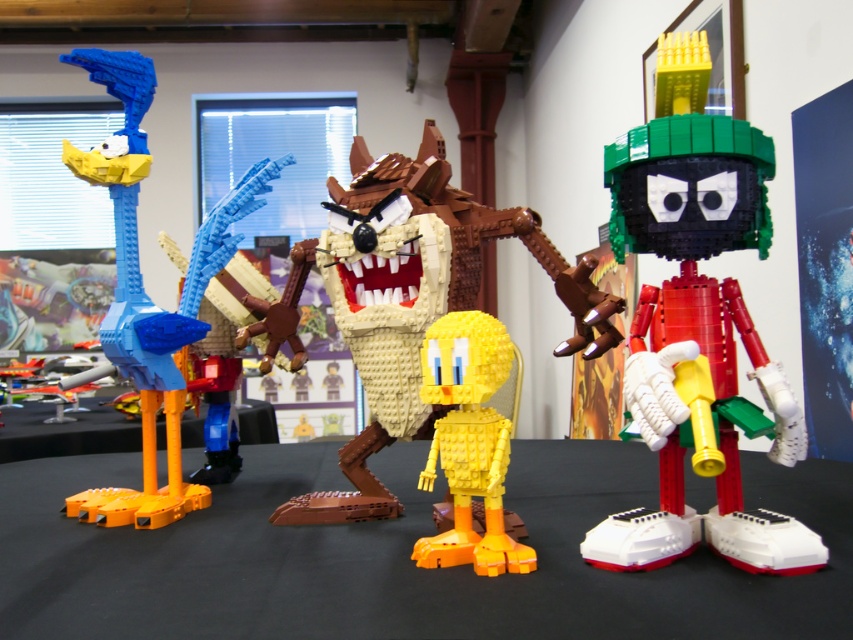
Question: Is brown matte/tile-like wolf at center to the left of yellow matte tweety bird at center from the viewer's perspective?

Choices:
 (A) yes
 (B) no

Answer: (A)

Question: Can you confirm if black plastic table at center is thinner than brown matte/tile-like wolf at center?

Choices:
 (A) no
 (B) yes

Answer: (A)

Question: Which point is closer to the camera taking this photo?

Choices:
 (A) (163, 444)
 (B) (427, 168)

Answer: (B)

Question: Which object is the closest to the brick red lego figure at right?

Choices:
 (A) brown matte/tile-like wolf at center
 (B) matte blue plastic bird at left
 (C) yellow matte tweety bird at center

Answer: (C)

Question: Which of these objects is positioned farthest from the yellow matte tweety bird at center?

Choices:
 (A) orange matte table at lower left
 (B) matte blue plastic duck at left
 (C) brown matte/tile-like wolf at center

Answer: (A)

Question: Considering the relative positions of orange matte table at lower left and matte blue plastic bird at left in the image provided, where is orange matte table at lower left located with respect to matte blue plastic bird at left?

Choices:
 (A) right
 (B) left

Answer: (B)